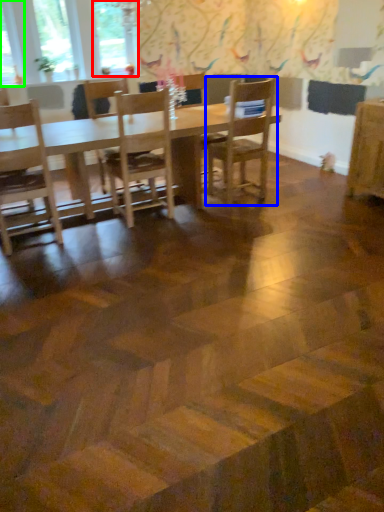
Question: Based on their relative distances, which object is nearer to window (highlighted by a red box)? Choose from chair (highlighted by a blue box) and window (highlighted by a green box).

Choices:
 (A) chair
 (B) window

Answer: (B)